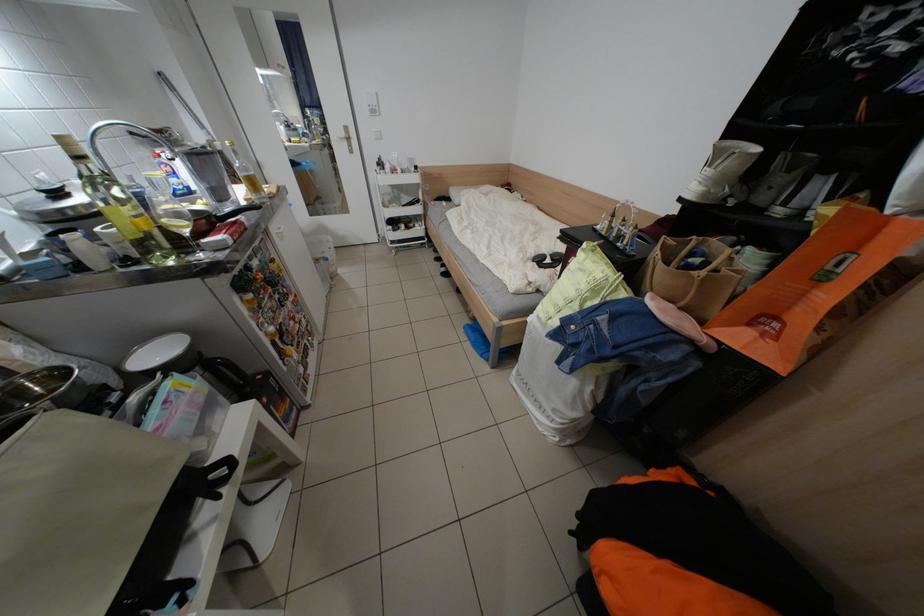
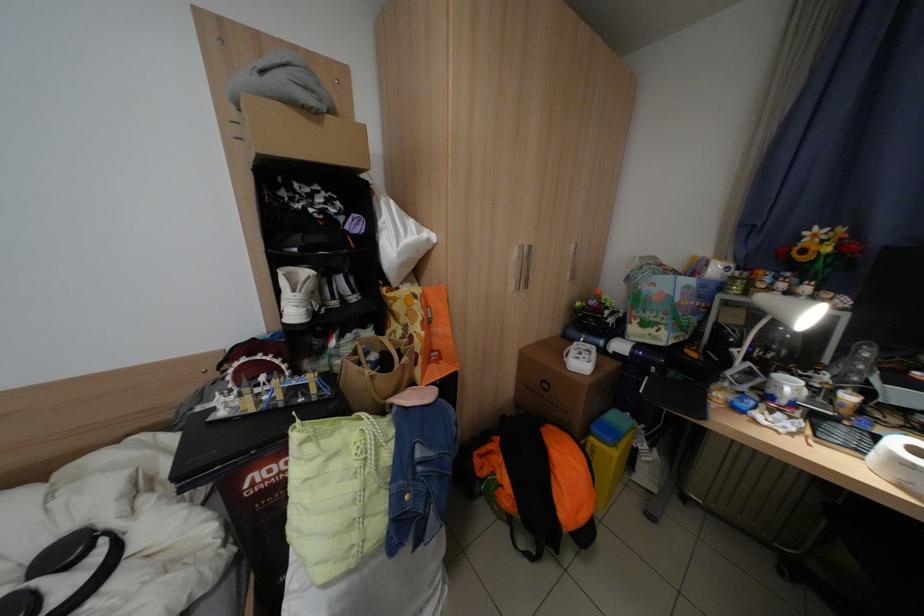
The point at (592,270) is marked in the first image. Where is the corresponding point in the second image?

(342, 460)